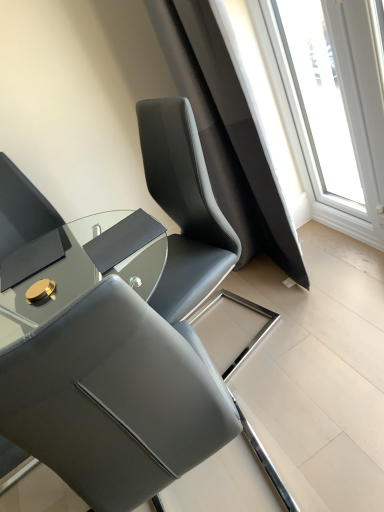
Question: Can you confirm if matte gray chair at center is positioned to the left of shiny black glass table at center?

Choices:
 (A) yes
 (B) no

Answer: (B)

Question: Is matte gray chair at center facing towards shiny black glass table at center?

Choices:
 (A) no
 (B) yes

Answer: (A)

Question: Does matte gray chair at center lie behind shiny black glass table at center?

Choices:
 (A) no
 (B) yes

Answer: (A)

Question: Does matte gray chair at center lie in front of shiny black glass table at center?

Choices:
 (A) no
 (B) yes

Answer: (B)

Question: From the image's perspective, is matte gray chair at center located above shiny black glass table at center?

Choices:
 (A) no
 (B) yes

Answer: (A)

Question: Would you say shiny black glass table at center is part of matte gray chair at center's contents?

Choices:
 (A) yes
 (B) no

Answer: (B)

Question: Considering the relative sizes of matte gray chair at center and transparent glass window at upper right in the image provided, is matte gray chair at center shorter than transparent glass window at upper right?

Choices:
 (A) no
 (B) yes

Answer: (B)

Question: From a real-world perspective, does matte gray chair at center sit lower than transparent glass window at upper right?

Choices:
 (A) no
 (B) yes

Answer: (B)

Question: Is matte gray chair at center at the right side of transparent glass window at upper right?

Choices:
 (A) no
 (B) yes

Answer: (A)

Question: Does matte gray chair at center appear on the left side of transparent glass window at upper right?

Choices:
 (A) yes
 (B) no

Answer: (A)

Question: Is matte gray chair at center thinner than transparent glass window at upper right?

Choices:
 (A) yes
 (B) no

Answer: (B)

Question: Is matte gray chair at center outside transparent glass window at upper right?

Choices:
 (A) yes
 (B) no

Answer: (A)

Question: Is transparent glass window at upper right facing towards shiny black glass table at center?

Choices:
 (A) no
 (B) yes

Answer: (B)